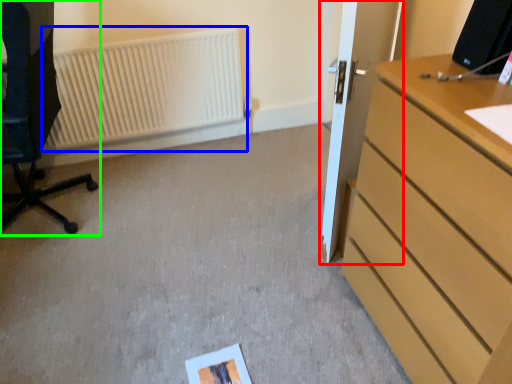
Question: Considering the real-world distances, which object is closest to door (highlighted by a red box)? radiator (highlighted by a blue box) or furniture (highlighted by a green box).

Choices:
 (A) radiator
 (B) furniture

Answer: (A)